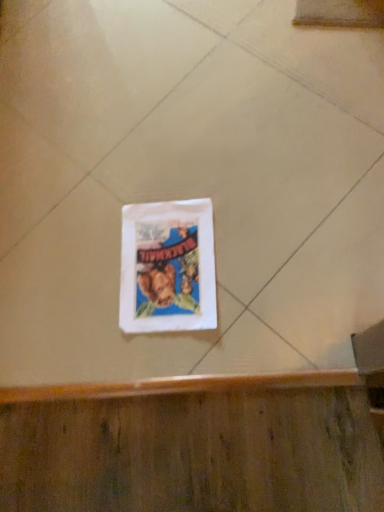
Where is `vacant space situated above white paper bag at center (from a real-world perspective)`? Image resolution: width=384 pixels, height=512 pixels. vacant space situated above white paper bag at center (from a real-world perspective) is located at coordinates (167, 264).